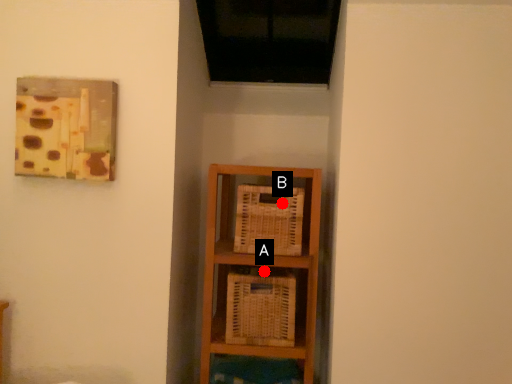
Question: Two points are circled on the image, labeled by A and B beside each circle. Which of the following is the closest to the observer?

Choices:
 (A) A is closer
 (B) B is closer

Answer: (A)